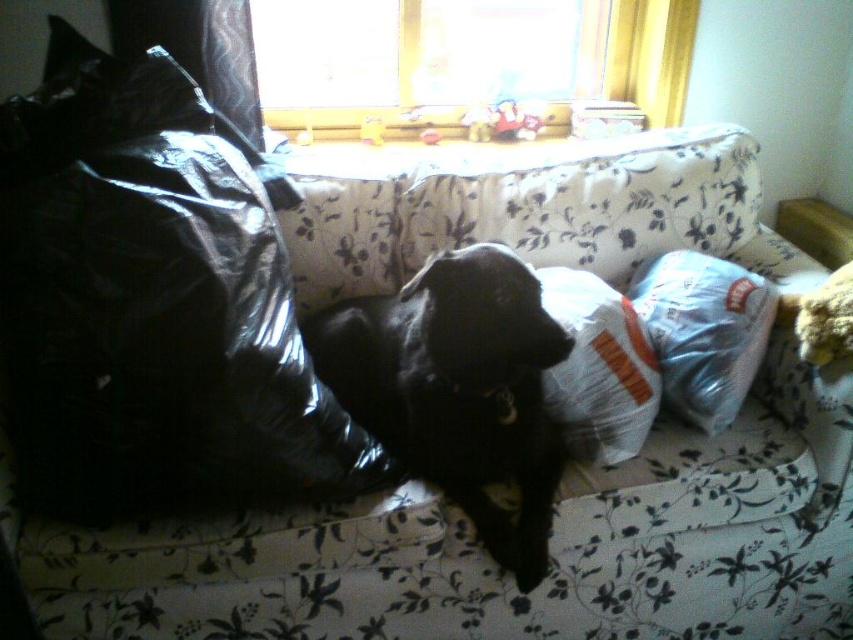
Is point (689, 392) positioned before point (544, 307)?

No, it is not.

Does white fabric pillow at right appear under white fabric pillow at center?

Incorrect, white fabric pillow at right is not positioned below white fabric pillow at center.

At what (x,y) coordinates should I click in order to perform the action: click on white fabric pillow at right. Please return your answer as a coordinate pair (x, y). This screenshot has height=640, width=853. Looking at the image, I should click on (703, 330).

I want to click on white fabric pillow at right, so click(x=703, y=330).

Can you confirm if black matte dog at center is taller than white fabric pillow at center?

Yes.

Does black matte dog at center come behind white fabric pillow at center?

No, black matte dog at center is in front of white fabric pillow at center.

The width and height of the screenshot is (853, 640). I want to click on black matte dog at center, so click(457, 388).

Can you confirm if black plastic bag at left is taller than white fabric pillow at center?

Indeed, black plastic bag at left has a greater height compared to white fabric pillow at center.

Who is more distant from viewer, (120, 369) or (577, 438)?

The point (577, 438) is behind.

Where is `black plastic bag at left`? black plastic bag at left is located at coordinates pyautogui.click(x=154, y=301).